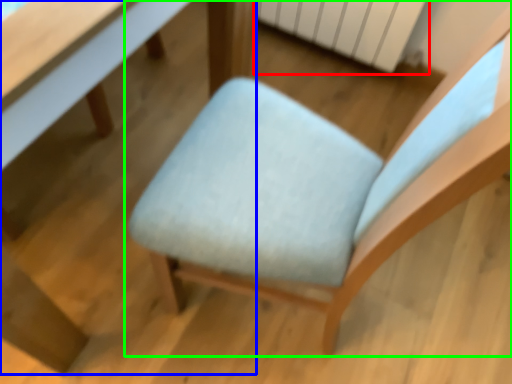
Question: Which object is positioned farthest from radiator (highlighted by a red box)? Select from table (highlighted by a blue box) and chair (highlighted by a green box).

Choices:
 (A) table
 (B) chair

Answer: (A)